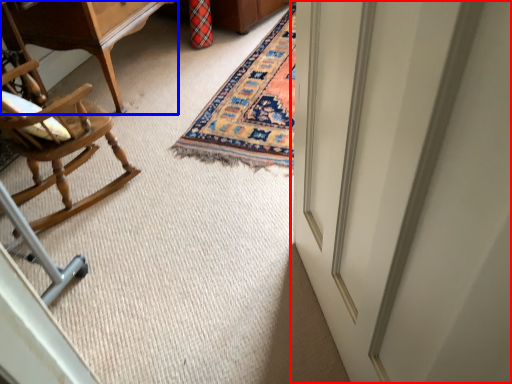
Question: Among these objects, which one is nearest to the camera, door (highlighted by a red box) or table (highlighted by a blue box)?

Choices:
 (A) door
 (B) table

Answer: (A)